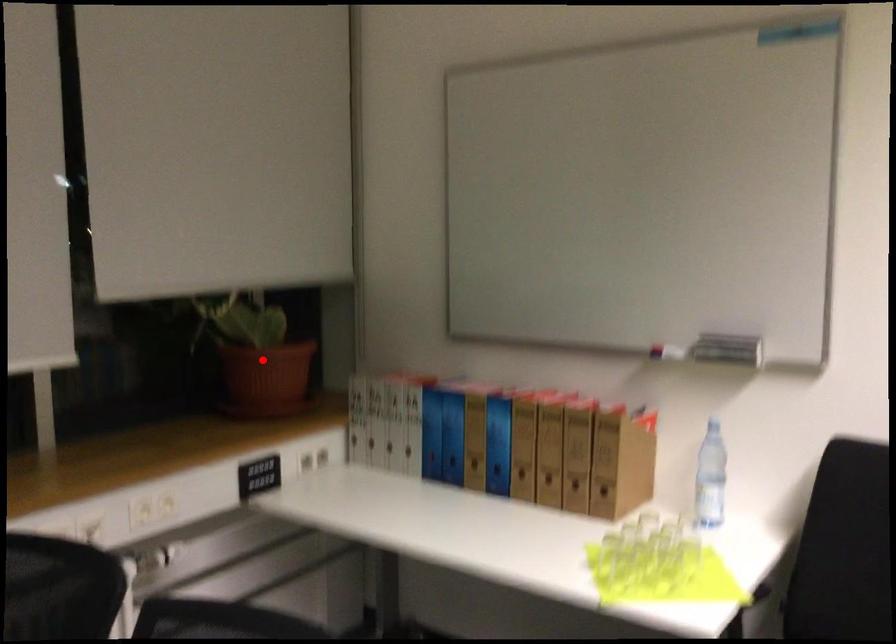
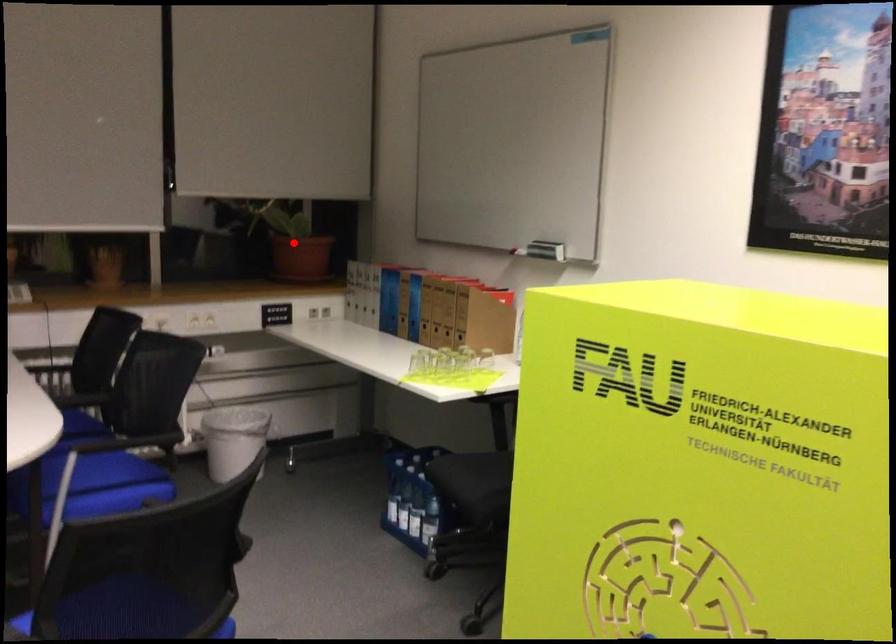
I am providing you with two images of the same scene from different viewpoints. A red point is marked on the first image and another point is marked on the second image. Does the point marked in image1 correspond to the same location as the one in image2?

Yes